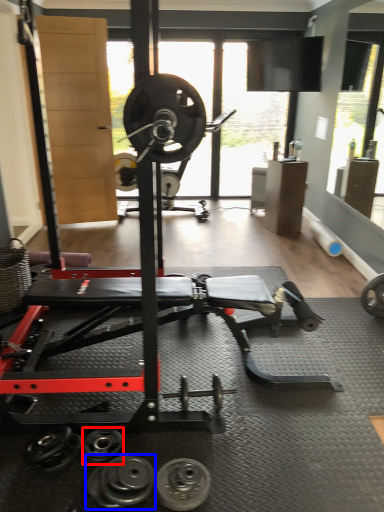
Question: Which of the following is the farthest to the observer, dumbbell (highlighted by a red box) or dumbbell (highlighted by a blue box)?

Choices:
 (A) dumbbell
 (B) dumbbell

Answer: (A)